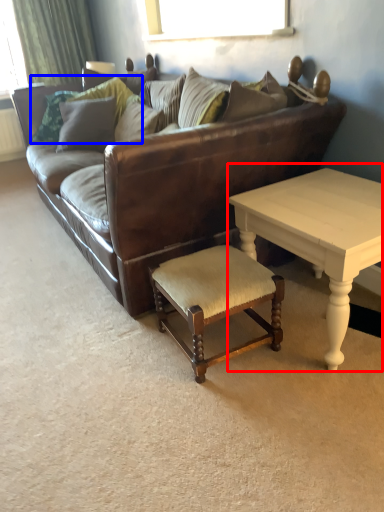
Question: Among these objects, which one is nearest to the camera, coffee table (highlighted by a red box) or pillow (highlighted by a blue box)?

Choices:
 (A) coffee table
 (B) pillow

Answer: (A)